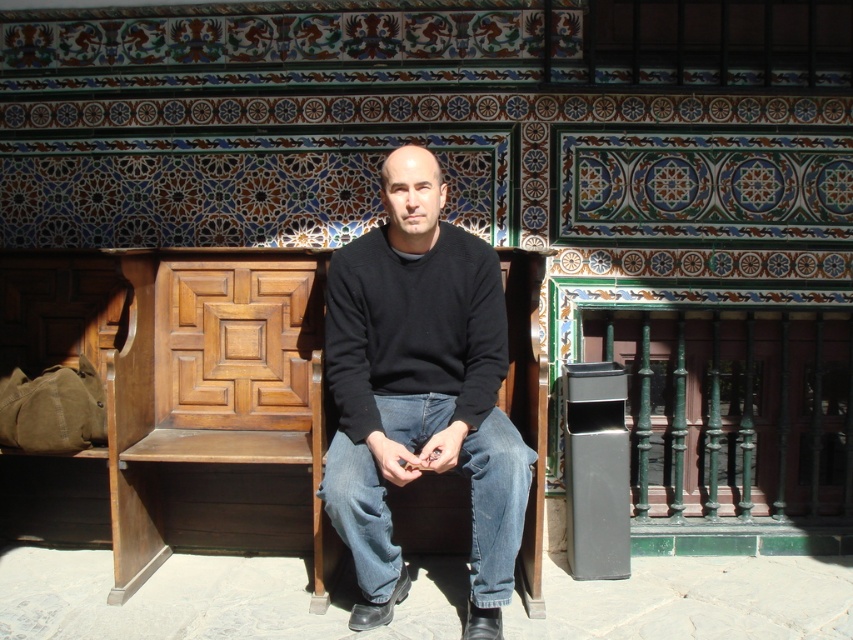
Question: Can you confirm if black sweater at center is positioned above denim at center?

Choices:
 (A) no
 (B) yes

Answer: (B)

Question: Which of these objects is positioned farthest from the black sweater at center?

Choices:
 (A) denim at center
 (B) black knitted sweater at center

Answer: (A)

Question: Does black sweater at center appear under black knitted sweater at center?

Choices:
 (A) no
 (B) yes

Answer: (B)

Question: Which object appears farthest from the camera in this image?

Choices:
 (A) black sweater at center
 (B) denim at center

Answer: (A)

Question: Which object is positioned farthest from the black sweater at center?

Choices:
 (A) denim at center
 (B) black knitted sweater at center

Answer: (A)

Question: Is black sweater at center below black knitted sweater at center?

Choices:
 (A) no
 (B) yes

Answer: (B)